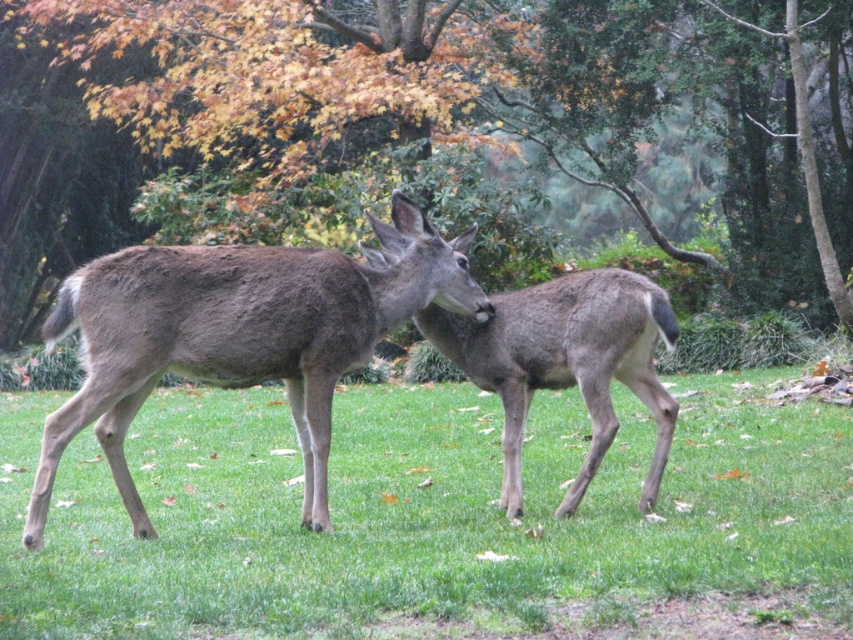
Does point (210, 442) lie in front of point (184, 362)?

No, (210, 442) is further to viewer.

Can you confirm if green grass at center is shorter than brown fuzzy roe deer at center?

Yes, green grass at center is shorter than brown fuzzy roe deer at center.

Describe the element at coordinates (426, 515) in the screenshot. I see `green grass at center` at that location.

Locate an element on the screen. green grass at center is located at coordinates (426, 515).

Looking at this image, is green leafy tree at center shorter than gray fur deer at center?

In fact, green leafy tree at center may be taller than gray fur deer at center.

Does green leafy tree at center come behind gray fur deer at center?

Yes, it is.

At what (x,y) coordinates should I click in order to perform the action: click on green leafy tree at center. Please return your answer as a coordinate pair (x, y). Looking at the image, I should click on (415, 125).

Does green grass at center appear on the left side of gray fur deer at center?

Yes, green grass at center is to the left of gray fur deer at center.

Is point (578, 440) behind point (601, 451)?

Yes, it is behind point (601, 451).

Does point (708, 568) lie in front of point (515, 410)?

Yes, it is in front of point (515, 410).

The height and width of the screenshot is (640, 853). What are the coordinates of `green grass at center` in the screenshot? It's located at (426, 515).